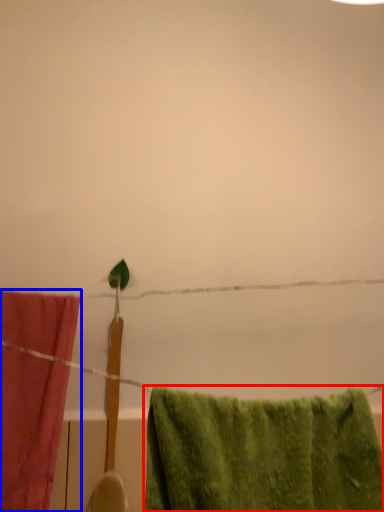
Question: Which of the following is the farthest to the observer, towel (highlighted by a red box) or towel (highlighted by a blue box)?

Choices:
 (A) towel
 (B) towel

Answer: (B)